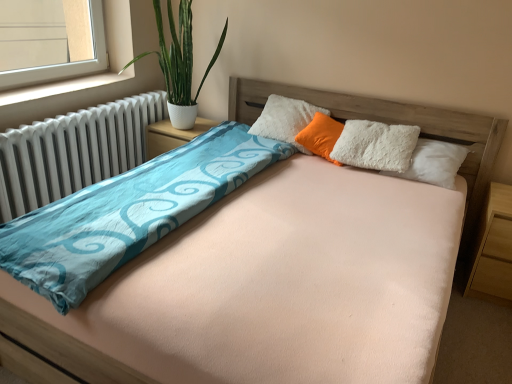
Question: Is green leafy plant in white pot at left facing towards white plastic window sill at left?

Choices:
 (A) no
 (B) yes

Answer: (A)

Question: Is green leafy plant in white pot at left bigger than white plastic window sill at left?

Choices:
 (A) yes
 (B) no

Answer: (A)

Question: From the image's perspective, does green leafy plant in white pot at left appear lower than white plastic window sill at left?

Choices:
 (A) no
 (B) yes

Answer: (A)

Question: From a real-world perspective, is green leafy plant in white pot at left located higher than white plastic window sill at left?

Choices:
 (A) no
 (B) yes

Answer: (B)

Question: Can you confirm if green leafy plant in white pot at left is thinner than white plastic window sill at left?

Choices:
 (A) no
 (B) yes

Answer: (A)

Question: Is green leafy plant in white pot at left positioned in front of white plastic window sill at left?

Choices:
 (A) no
 (B) yes

Answer: (A)

Question: From the image's perspective, does light brown wood at right, placed as the second nightstand when sorted from top to bottom, appear lower than green leafy plant in white pot at left?

Choices:
 (A) no
 (B) yes

Answer: (B)

Question: Is light brown wood at right, marked as the 1th nightstand in a front-to-back arrangement, at the left side of green leafy plant in white pot at left?

Choices:
 (A) no
 (B) yes

Answer: (A)

Question: Can you confirm if light brown wood at right, marked as the 1th nightstand in a bottom-to-top arrangement, is bigger than green leafy plant in white pot at left?

Choices:
 (A) yes
 (B) no

Answer: (B)

Question: Does light brown wood at right, acting as the 2th nightstand starting from the back, have a smaller size compared to green leafy plant in white pot at left?

Choices:
 (A) no
 (B) yes

Answer: (B)

Question: Can you confirm if light brown wood at right, arranged as the 1th nightstand when viewed from the right, is shorter than green leafy plant in white pot at left?

Choices:
 (A) yes
 (B) no

Answer: (A)

Question: Is there a large distance between light brown wood at right, marked as the 1th nightstand in a front-to-back arrangement, and green leafy plant in white pot at left?

Choices:
 (A) no
 (B) yes

Answer: (B)

Question: Is light brown wood at right, which is the second nightstand from left to right, a part of white textured nightstand at center, acting as the first nightstand starting from the back?

Choices:
 (A) yes
 (B) no

Answer: (B)